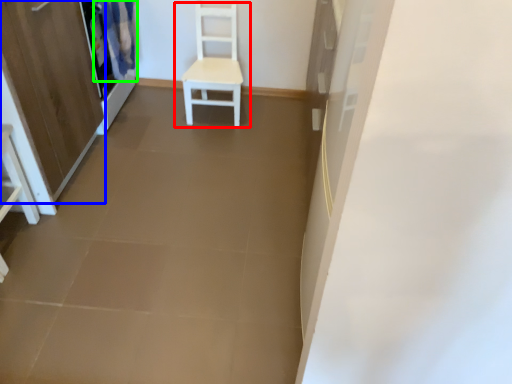
Question: Which object is the farthest from chair (highlighted by a red box)? Choose among these: screen door (highlighted by a blue box) or curtain (highlighted by a green box).

Choices:
 (A) screen door
 (B) curtain

Answer: (A)